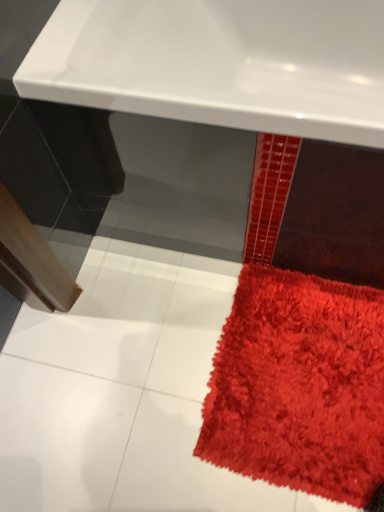
This screenshot has width=384, height=512. In order to click on free space above shaggy red rug at lower right (from a real-world perspective) in this screenshot , I will do pos(305,373).